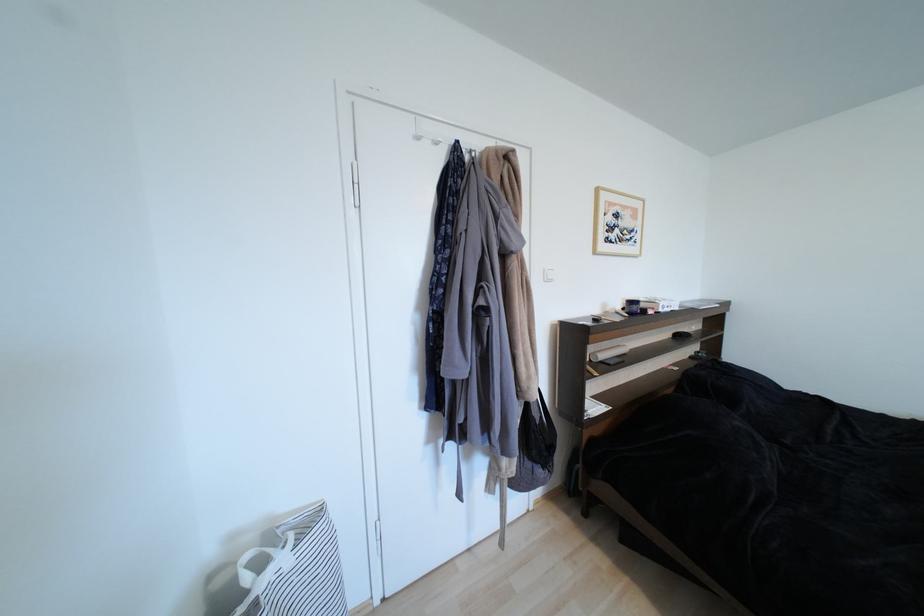
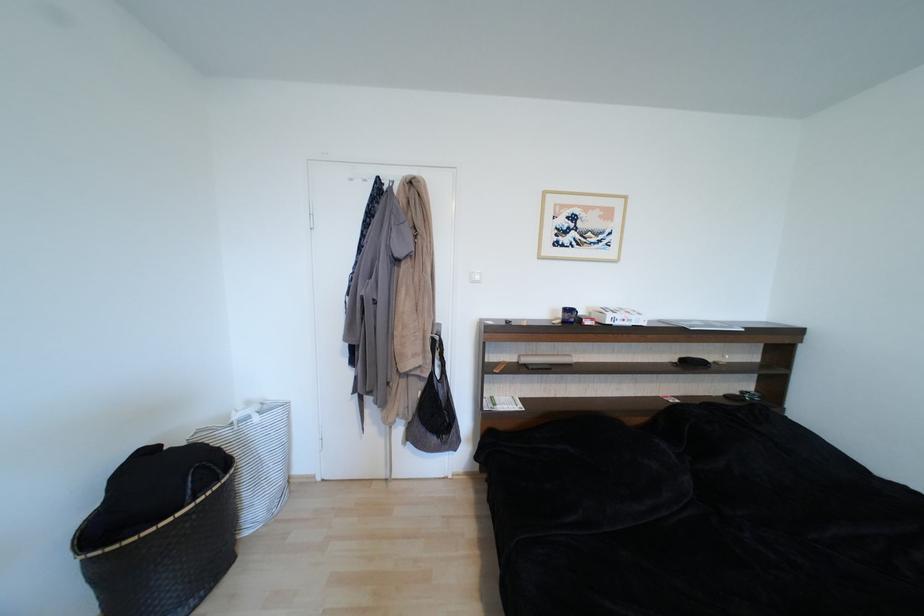
Question: Which direction would the cameraman need to move to produce the second image? Reply with the corresponding letter.

Choices:
 (A) Left
 (B) Right
 (C) Forward
 (D) Backward

Answer: (B)